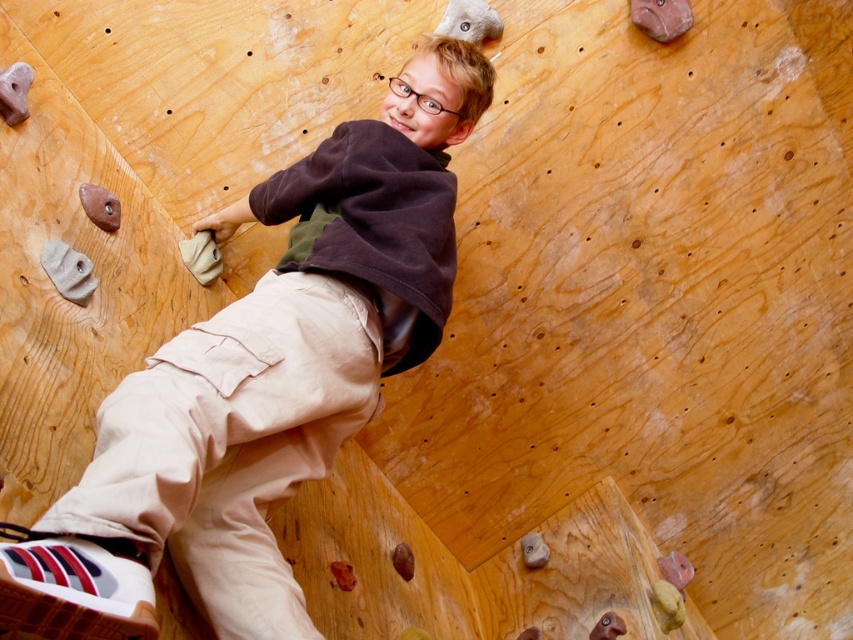
You are a rock climbing instructor observing the boy on the climbing wall. You notice two points marked on the wall at coordinates point (228, 384) and point (236, 356). Which point is closer to the boy as he is currently positioned?

Point (228, 384) is in front of point (236, 356), so the point closer to the boy is point (228, 384).

From the picture: You are a photographer trying to capture the boy climbing. You notice the brown cotton shirt at upper center and the khaki pants at center in your viewfinder. Which clothing item is closer to the camera lens?

The brown cotton shirt at upper center is closer to the camera lens because it is in front of the khaki pants at center.